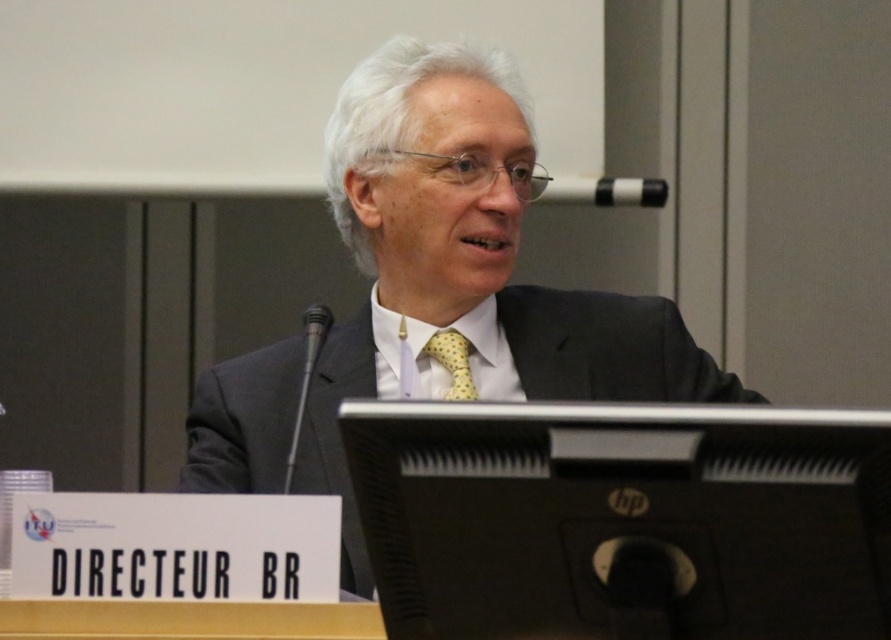
Looking at this image, between black plastic microphone at upper center and metallic silver microphone at center, which one appears on the right side from the viewer's perspective?

black plastic microphone at upper center is more to the right.

In the scene shown: Is black plastic microphone at upper center taller than metallic silver microphone at center?

In fact, black plastic microphone at upper center may be shorter than metallic silver microphone at center.

This screenshot has height=640, width=891. Describe the element at coordinates (607, 192) in the screenshot. I see `black plastic microphone at upper center` at that location.

Locate an element on the screen. The height and width of the screenshot is (640, 891). black plastic microphone at upper center is located at coordinates (607, 192).

From the picture: Can you confirm if matte black suit at center is positioned to the left of black plastic microphone at upper center?

Correct, you'll find matte black suit at center to the left of black plastic microphone at upper center.

Does matte black suit at center appear on the right side of black plastic microphone at upper center?

No, matte black suit at center is not to the right of black plastic microphone at upper center.

The width and height of the screenshot is (891, 640). Identify the location of matte black suit at center. (464, 266).

Is matte black suit at center thinner than yellow dotted fabric tie at center?

No, matte black suit at center is not thinner than yellow dotted fabric tie at center.

Locate an element on the screen. This screenshot has width=891, height=640. matte black suit at center is located at coordinates (464, 266).

The height and width of the screenshot is (640, 891). I want to click on matte black suit at center, so click(464, 266).